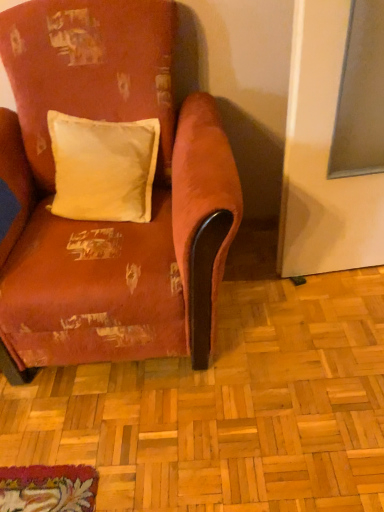
This screenshot has width=384, height=512. What do you see at coordinates (103, 168) in the screenshot?
I see `white cotton pillow at center` at bounding box center [103, 168].

In order to face white cotton pillow at center, should I rotate leftwards or rightwards?

You should look left and rotate roughly 12.260 degrees.

Image resolution: width=384 pixels, height=512 pixels. Find the location of `white cotton pillow at center`. white cotton pillow at center is located at coordinates (103, 168).

Describe the element at coordinates (109, 222) in the screenshot. Image resolution: width=384 pixels, height=512 pixels. I see `velvet-like red armchair at center` at that location.

In order to click on velvet-like red armchair at center in this screenshot , I will do tap(109, 222).

Where is `white cotton pillow at center`? white cotton pillow at center is located at coordinates pos(103,168).

Which is more to the left, white cotton pillow at center or velvet-like red armchair at center?

From the viewer's perspective, velvet-like red armchair at center appears more on the left side.

Considering the relative positions of white cotton pillow at center and velvet-like red armchair at center in the image provided, is white cotton pillow at center behind velvet-like red armchair at center?

That is True.

Is point (57, 188) closer or farther from the camera than point (98, 258)?

Point (57, 188) appears to be farther away from the viewer than point (98, 258).

From the image's perspective, is white cotton pillow at center above or below velvet-like red armchair at center?

white cotton pillow at center is situated higher than velvet-like red armchair at center in the image.

Based on the photo, from a real-world perspective, between white cotton pillow at center and velvet-like red armchair at center, who is vertically higher?

In real-world perspective, white cotton pillow at center is above.

Which of these two, white cotton pillow at center or velvet-like red armchair at center, is thinner?

white cotton pillow at center is thinner.

Considering the sizes of objects white cotton pillow at center and velvet-like red armchair at center in the image provided, who is taller, white cotton pillow at center or velvet-like red armchair at center?

Standing taller between the two is velvet-like red armchair at center.

Looking at this image, which of these two, white cotton pillow at center or velvet-like red armchair at center, is bigger?

Bigger between the two is velvet-like red armchair at center.

Is white cotton pillow at center not within velvet-like red armchair at center?

Actually, white cotton pillow at center is within velvet-like red armchair at center.

Is the surface of white cotton pillow at center in direct contact with velvet-like red armchair at center?

No, white cotton pillow at center is not touching velvet-like red armchair at center.

Is white cotton pillow at center oriented away from velvet-like red armchair at center?

Yes, white cotton pillow at center is positioned with its back facing velvet-like red armchair at center.

The image size is (384, 512). I want to click on chair that appears below the white cotton pillow at center (from the image's perspective), so [x=109, y=222].

Consider the image. Which object is positioned more to the left, velvet-like red armchair at center or white cotton pillow at center?

Positioned to the left is velvet-like red armchair at center.

Relative to white cotton pillow at center, is velvet-like red armchair at center in front or behind?

In the image, velvet-like red armchair at center appears in front of white cotton pillow at center.

Which is more distant, (78, 263) or (81, 137)?

Positioned behind is point (81, 137).

From the image's perspective, is velvet-like red armchair at center beneath white cotton pillow at center?

Yes, from the image's perspective, velvet-like red armchair at center is below white cotton pillow at center.

From the picture: From a real-world perspective, is velvet-like red armchair at center physically above white cotton pillow at center?

Incorrect, from a real-world perspective, velvet-like red armchair at center is lower than white cotton pillow at center.

Between velvet-like red armchair at center and white cotton pillow at center, which one has larger width?

velvet-like red armchair at center.

Is velvet-like red armchair at center taller or shorter than white cotton pillow at center?

Clearly, velvet-like red armchair at center is taller compared to white cotton pillow at center.

Based on the photo, can you confirm if velvet-like red armchair at center is bigger than white cotton pillow at center?

Indeed, velvet-like red armchair at center has a larger size compared to white cotton pillow at center.

Is velvet-like red armchair at center situated inside white cotton pillow at center or outside?

velvet-like red armchair at center cannot be found inside white cotton pillow at center.

Is velvet-like red armchair at center next to white cotton pillow at center?

No, velvet-like red armchair at center is not making contact with white cotton pillow at center.

Is velvet-like red armchair at center oriented towards white cotton pillow at center?

Yes, velvet-like red armchair at center faces towards white cotton pillow at center.

Where is `pillow on the right of velvet-like red armchair at center`? The image size is (384, 512). pillow on the right of velvet-like red armchair at center is located at coordinates (103, 168).

At what (x,y) coordinates should I click in order to perform the action: click on pillow above the velvet-like red armchair at center (from the image's perspective). Please return your answer as a coordinate pair (x, y). Image resolution: width=384 pixels, height=512 pixels. Looking at the image, I should click on (103, 168).

The height and width of the screenshot is (512, 384). In order to click on pillow that appears above the velvet-like red armchair at center (from a real-world perspective) in this screenshot , I will do `click(103, 168)`.